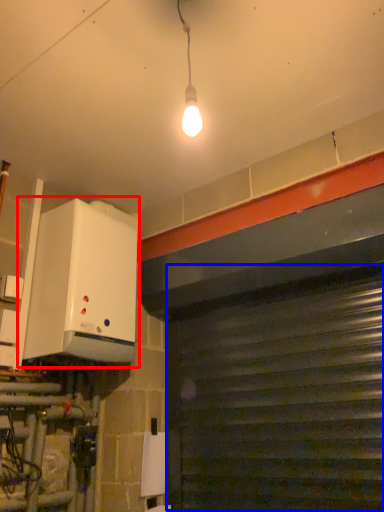
Question: Which object appears farthest to the camera in this image, appliance (highlighted by a red box) or garage door (highlighted by a blue box)?

Choices:
 (A) appliance
 (B) garage door

Answer: (A)